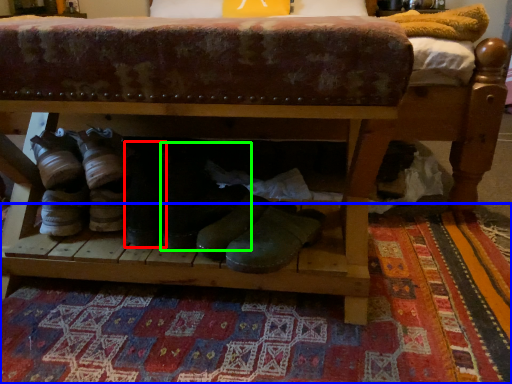
Question: Which object is the farthest from footwear (highlighted by a red box)? Choose among these: mat (highlighted by a blue box) or footwear (highlighted by a green box).

Choices:
 (A) mat
 (B) footwear

Answer: (A)